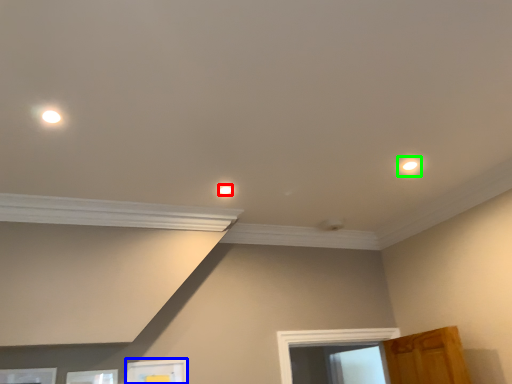
Question: Considering the real-world distances, which object is closest to dot (highlighted by a red box)? picture frame (highlighted by a blue box) or dot (highlighted by a green box).

Choices:
 (A) picture frame
 (B) dot

Answer: (B)